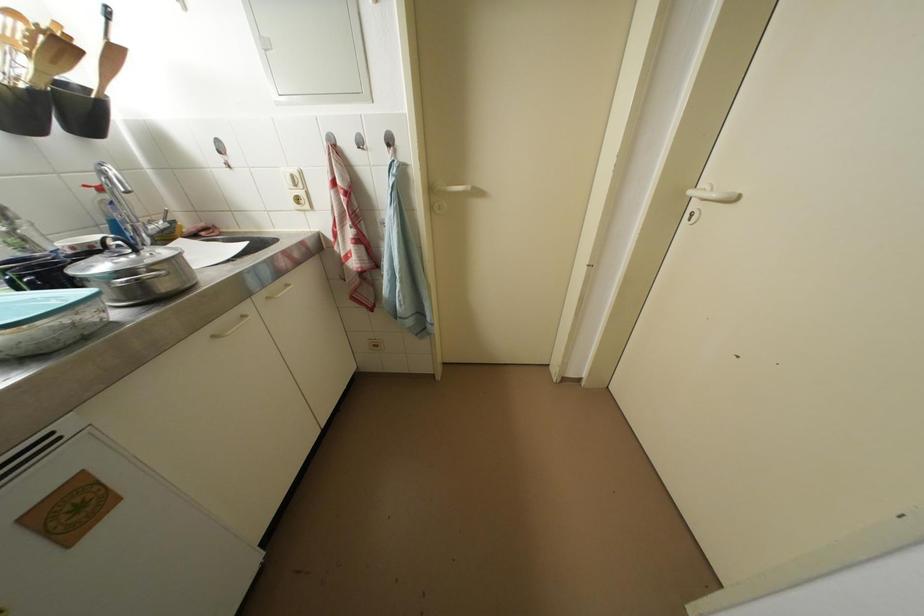
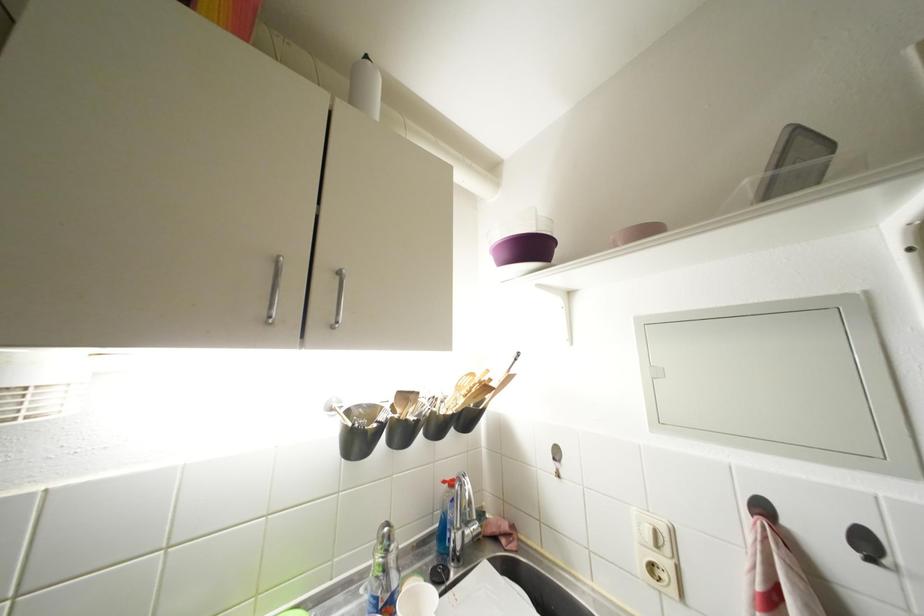
Find the pixel in the second image that matches point (366, 151) in the first image.

(877, 565)